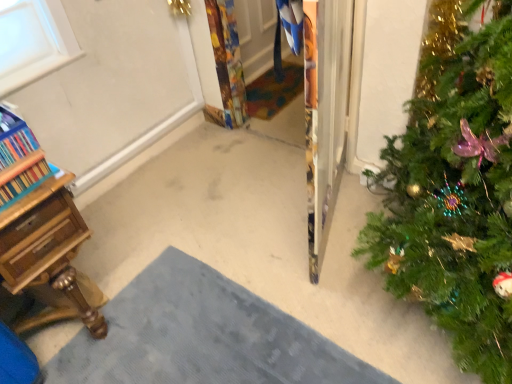
Where is `vacant space behind wooden desk at lower left`? This screenshot has height=384, width=512. vacant space behind wooden desk at lower left is located at coordinates (100, 253).